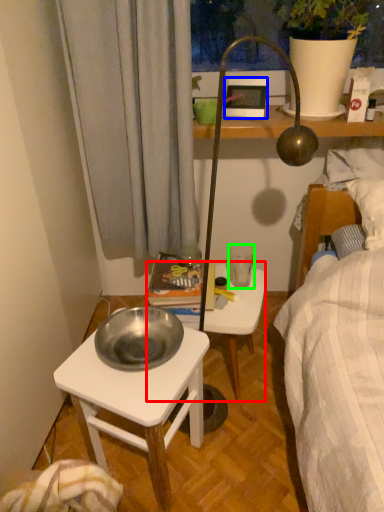
Question: Which object is positioned closest to stool (highlighted by a red box)? Select from picture frame (highlighted by a blue box) and coffee cup (highlighted by a green box).

Choices:
 (A) picture frame
 (B) coffee cup

Answer: (B)